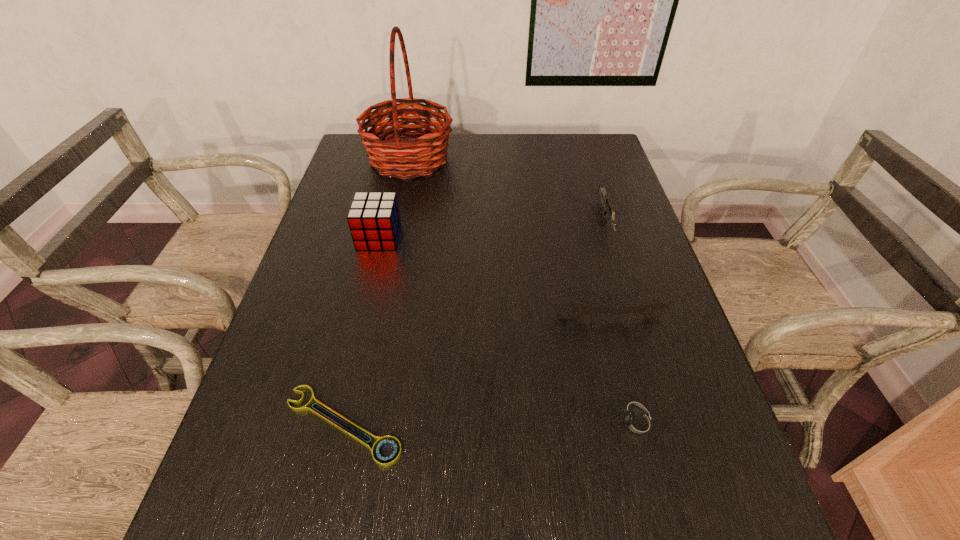
Identify the location of vacant space located on the right of the cube. (436, 237).

Where is `vacant space located aimed along the barrel of the gun`? vacant space located aimed along the barrel of the gun is located at coordinates (637, 322).

Where is `vacant space situated 0.200m on the open ends of the right wrench`? vacant space situated 0.200m on the open ends of the right wrench is located at coordinates (630, 400).

The height and width of the screenshot is (540, 960). I want to click on free space located 0.230m on the face of the watch, so click(485, 423).

Where is `free region located on the face of the watch`? The width and height of the screenshot is (960, 540). free region located on the face of the watch is located at coordinates (485, 423).

This screenshot has height=540, width=960. Find the location of `vacant area situated 0.340m on the face of the watch`. vacant area situated 0.340m on the face of the watch is located at coordinates (426, 423).

The width and height of the screenshot is (960, 540). Identify the location of vacant space located on the right of the shortest object. (507, 424).

This screenshot has width=960, height=540. Find the location of `object that is positioned at the far edge`. object that is positioned at the far edge is located at coordinates (428, 151).

At what (x,y) coordinates should I click in order to perform the action: click on basket that is at the left edge. Please return your answer as a coordinate pair (x, y). Looking at the image, I should click on coord(428,151).

At what (x,y) coordinates should I click in order to perform the action: click on cube at the left edge. Please return your answer as a coordinate pair (x, y). Image resolution: width=960 pixels, height=540 pixels. Looking at the image, I should click on (374, 220).